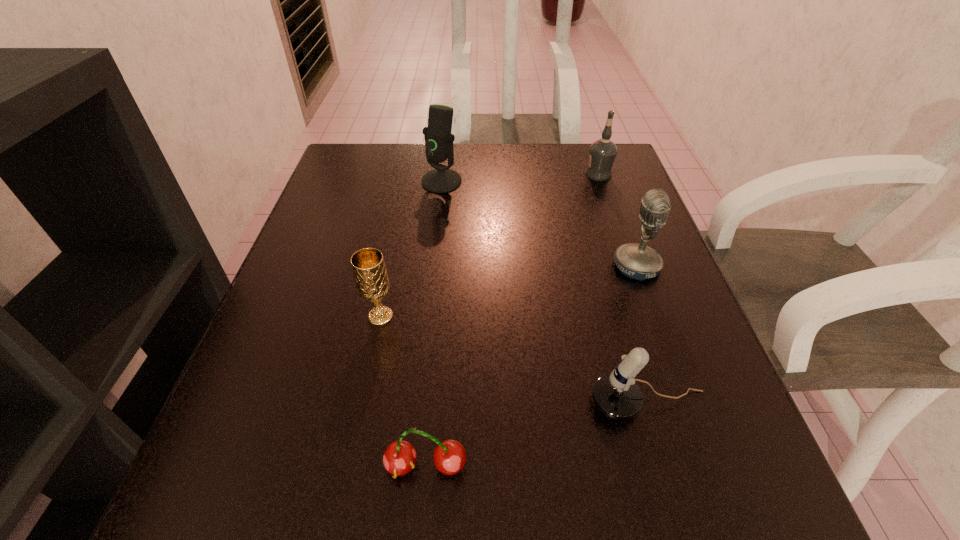
Locate an element on the screen. The image size is (960, 540). object located in the near edge section of the desktop is located at coordinates (400, 457).

This screenshot has height=540, width=960. What are the coordinates of `vodka present at the right edge` in the screenshot? It's located at [603, 151].

The image size is (960, 540). Find the location of `object located at the far right corner`. object located at the far right corner is located at coordinates (603, 151).

Locate an element on the screen. This screenshot has height=540, width=960. free space at the far edge of the desktop is located at coordinates (398, 177).

At what (x,y) coordinates should I click in order to perform the action: click on blank space at the near edge of the desktop. Please return your answer as a coordinate pair (x, y). Looking at the image, I should click on (556, 498).

Where is `vacant space at the left edge`? vacant space at the left edge is located at coordinates (350, 296).

Image resolution: width=960 pixels, height=540 pixels. Find the location of `vacant point at the right edge`. vacant point at the right edge is located at coordinates (654, 356).

In the image, there is a desktop. Identify the location of vacant space at the far left corner. Image resolution: width=960 pixels, height=540 pixels. pos(376,177).

You are a GUI agent. You are given a task and a screenshot of the screen. Output one action in this format:
    pyautogui.click(x=<x>, y=<y>)
    Task: Click on the free space at the near left corner of the desktop
    
    Given the screenshot: What is the action you would take?
    pyautogui.click(x=204, y=512)

Where is `vacant space at the near right corner of the desktop`? vacant space at the near right corner of the desktop is located at coordinates pyautogui.click(x=770, y=489).